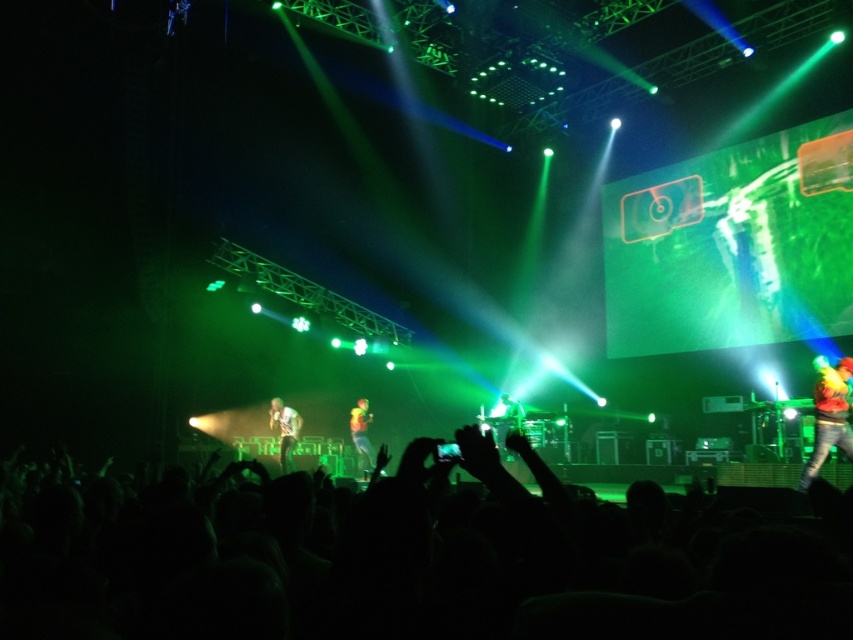
Locate an element on the screen. The image size is (853, 640). shiny metallic jacket at right is located at coordinates (828, 417).

Is silhouette crowd at lower center positioned behind shiny metallic jacket at right?

No.

Can you confirm if silhouette crowd at lower center is thinner than shiny metallic jacket at right?

Indeed, silhouette crowd at lower center has a lesser width compared to shiny metallic jacket at right.

Between point (465, 573) and point (815, 464), which one is positioned in front?

Positioned in front is point (465, 573).

I want to click on silhouette crowd at lower center, so click(392, 561).

Who is taller, white textured shirt at center or shiny silver microphone at center?

With more height is white textured shirt at center.

Between white textured shirt at center and shiny silver microphone at center, which one is positioned higher?

Positioned higher is shiny silver microphone at center.

Image resolution: width=853 pixels, height=640 pixels. I want to click on white textured shirt at center, so click(x=283, y=429).